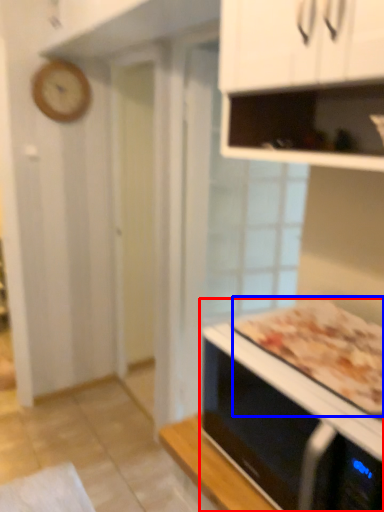
Question: Which of the following is the farthest to the observer, microwave oven (highlighted by a red box) or pizza (highlighted by a blue box)?

Choices:
 (A) microwave oven
 (B) pizza

Answer: (B)